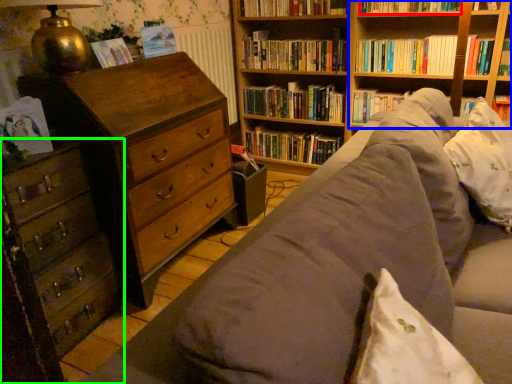
Question: Which object is the closest to the book (highlighted by a red box)? Choose among these: shelf (highlighted by a blue box) or chest of drawers (highlighted by a green box).

Choices:
 (A) shelf
 (B) chest of drawers

Answer: (A)